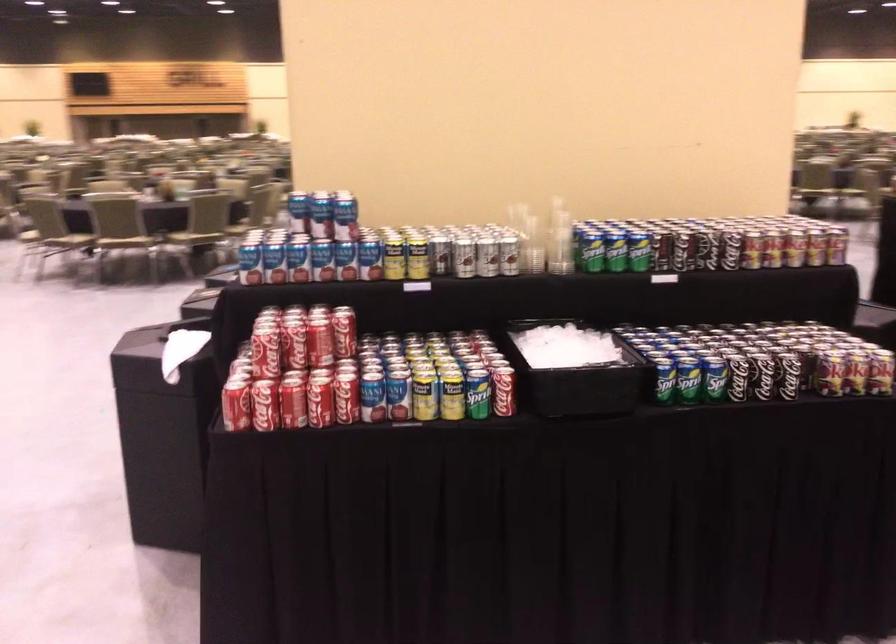
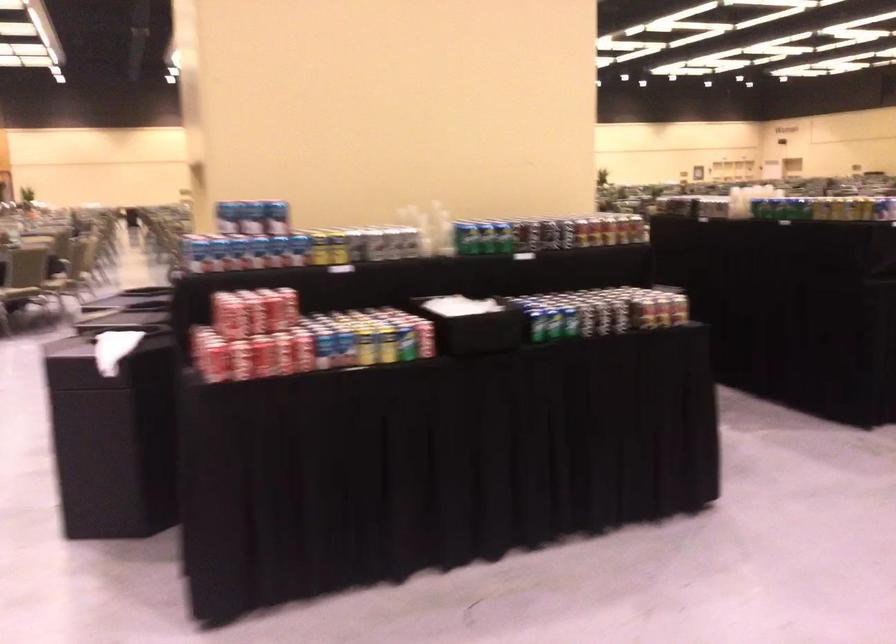
Find the pixel in the second image that matches point (328, 337) in the first image.

(279, 307)